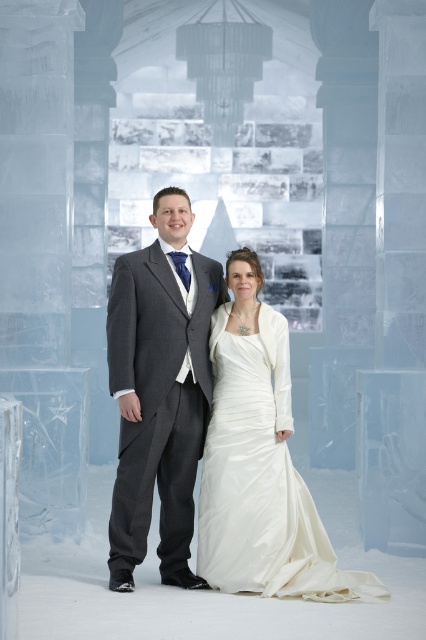
The scene shows a couple in an ice structure. There is a point at coordinates (160, 390). What object is located at that point?

The point at coordinates (160, 390) corresponds to the charcoal gray suit at center.

You are a photographer preparing to take a portrait of the couple in the ice structure. The white satin dress at center belongs to the woman, and the satin white dress at center is part of the ice sculpture nearby. Since you want to ensure the woman is the main focus, will the distance between the two dresses allow you to blur the background ice sculpture effectively using a shallow depth of field?

The distance between the white satin dress at center and the satin white dress at center is 3.18 centimeters. To effectively blur the background ice sculpture, a greater distance is typically needed. With such a small separation, achieving a shallow depth of field might be challenging, so the background may remain somewhat in focus.